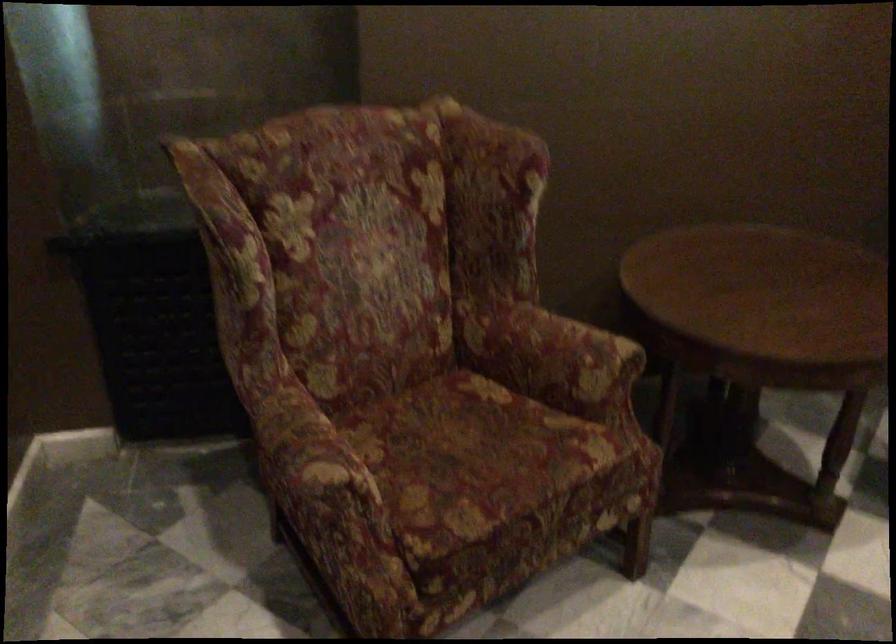
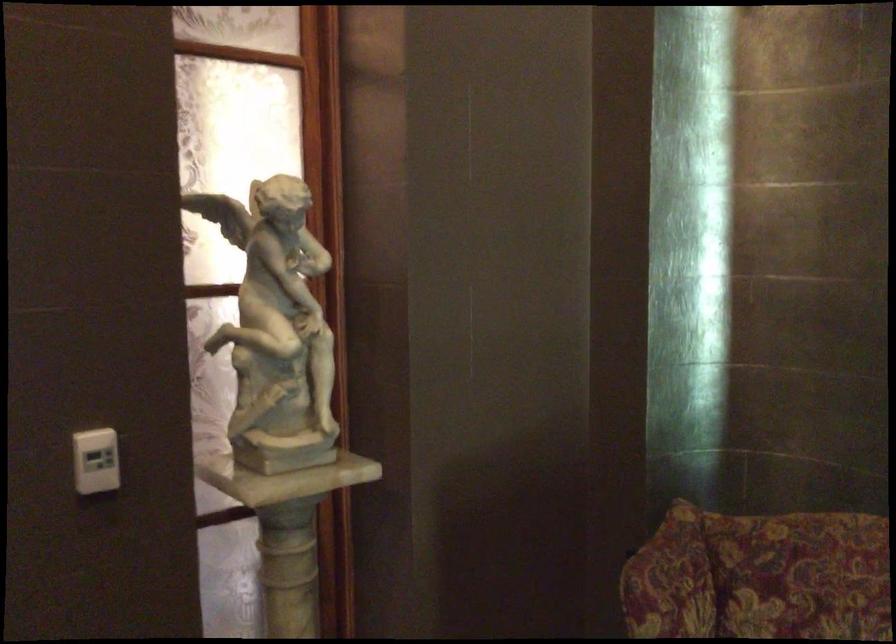
Question: The camera is either moving clockwise (left) or counter-clockwise (right) around the object. The first image is from the beginning of the video and the second image is from the end. Is the camera moving left or right when shooting the video?

Choices:
 (A) Left
 (B) Right

Answer: (B)